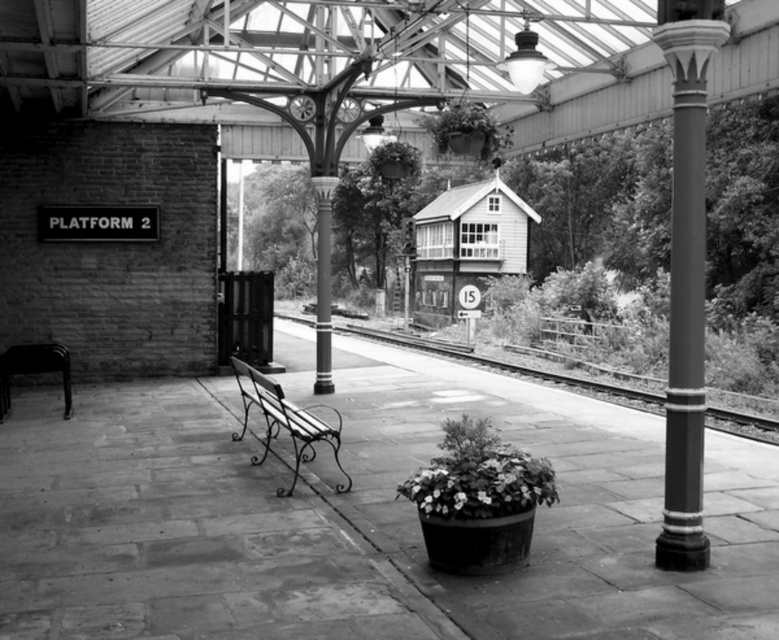
Question: Can you confirm if wooden bench at center is positioned below green leafy plant at upper center?

Choices:
 (A) yes
 (B) no

Answer: (A)

Question: Which of the following is the farthest from the observer?

Choices:
 (A) metal train track at center
 (B) wooden signal box at center
 (C) polished metal pole at right
 (D) wooden bench at center

Answer: (B)

Question: Considering the real-world distances, which object is closest to the fluffy green plant at center?

Choices:
 (A) black wrought iron bench at lower left
 (B) wooden bench at center
 (C) green leafy plant at upper center
 (D) metal train track at center

Answer: (B)

Question: Which of these objects is positioned closest to the wooden signal box at center?

Choices:
 (A) green leafy plant at upper center
 (B) polished metal pole at right
 (C) black wrought iron bench at lower left

Answer: (A)

Question: Does green leafy plant at upper center have a larger size compared to black wrought iron bench at lower left?

Choices:
 (A) no
 (B) yes

Answer: (B)

Question: Can you confirm if fluffy green plant at center is positioned above black wrought iron bench at lower left?

Choices:
 (A) yes
 (B) no

Answer: (B)